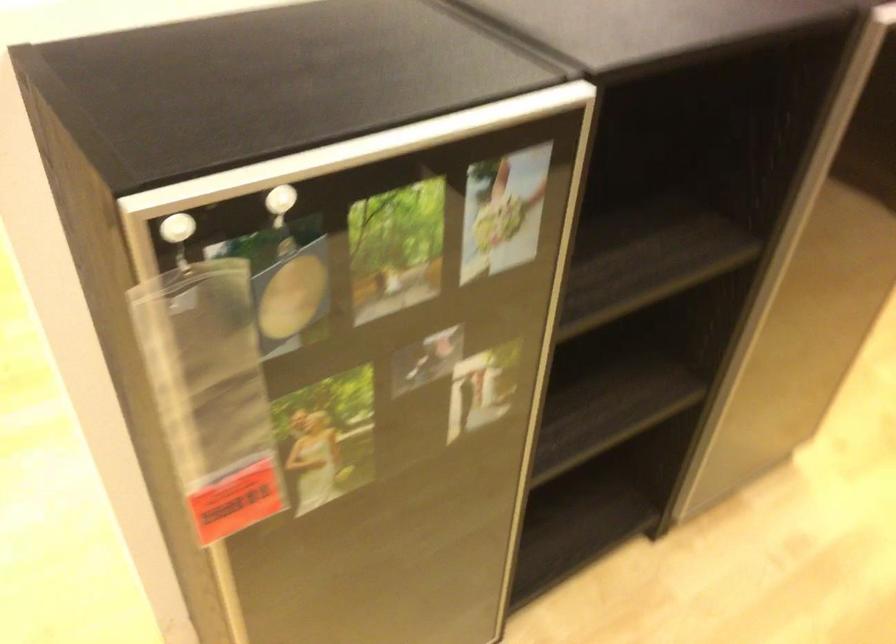
Where is `silver door frame`? The image size is (896, 644). silver door frame is located at coordinates point(356,152).